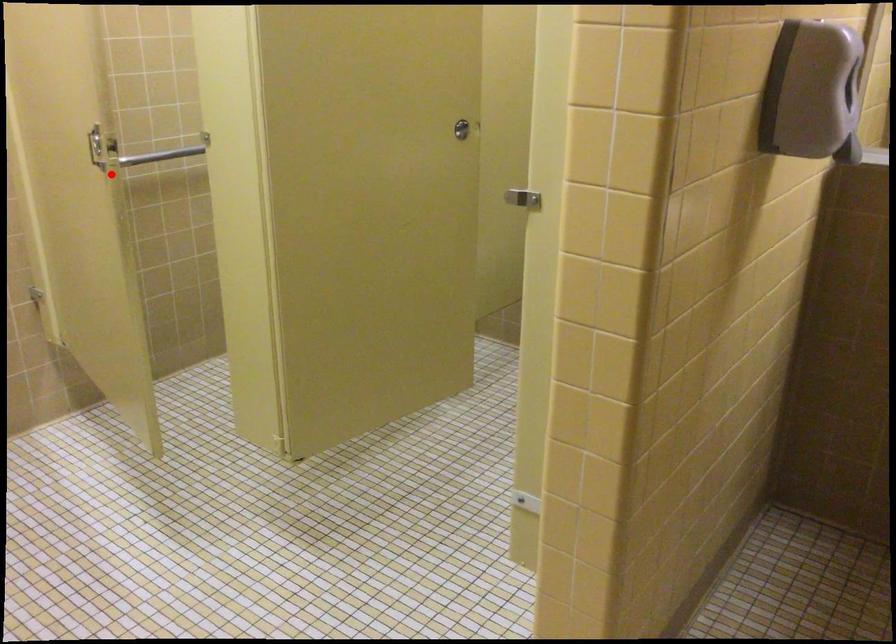
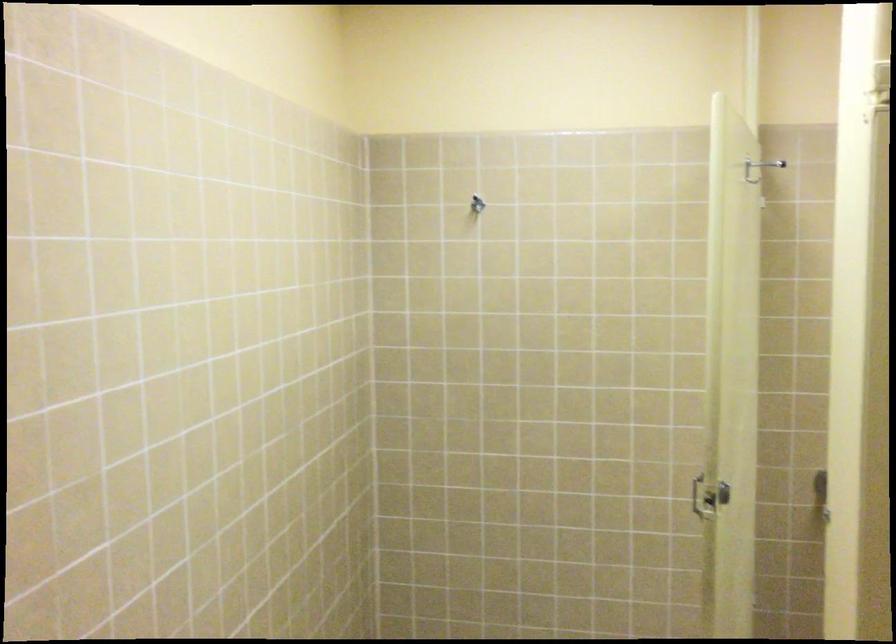
Question: I am providing you with two images of the same scene from different viewpoints. Given a red point in image1, look at the same physical point in image2. Is it:

Choices:
 (A) Closer to the viewpoint
 (B) Farther from the viewpoint

Answer: (A)